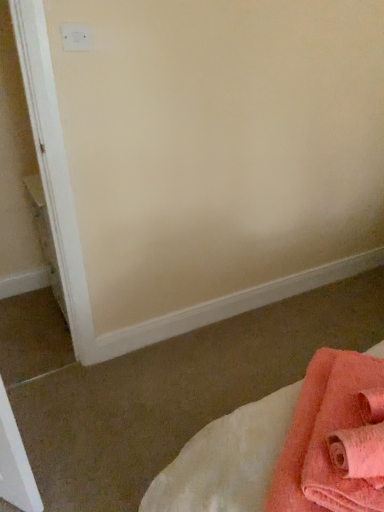
Question: From the image's perspective, is soft pink towel at lower right positioned above or below white plastic electric outlet at upper left?

Choices:
 (A) below
 (B) above

Answer: (A)

Question: From a real-world perspective, is soft pink towel at lower right above or below white plastic electric outlet at upper left?

Choices:
 (A) below
 (B) above

Answer: (A)

Question: Which object is the closest to the white plastic electric outlet at upper left?

Choices:
 (A) soft coral towel at lower right
 (B) soft pink towel at lower right

Answer: (A)

Question: Estimate the real-world distances between objects in this image. Which object is farther from the soft coral towel at lower right?

Choices:
 (A) soft pink towel at lower right
 (B) white plastic electric outlet at upper left

Answer: (B)